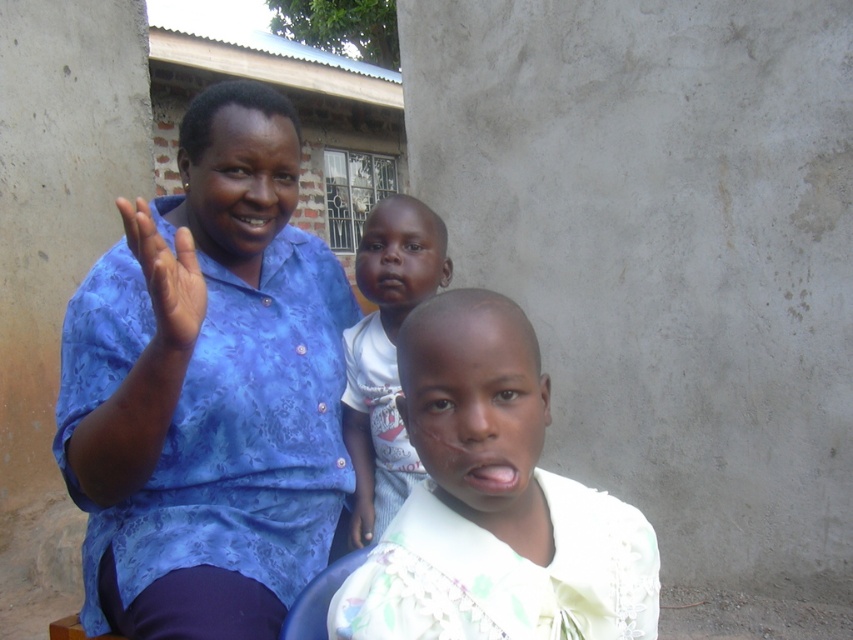
You are taking a photo of the scene and want to focus on both the point at point (126, 508) and the point at point (364, 243). Which point should you focus on first to ensure both are in focus?

You should focus on point (126, 508) first because it is closer to the camera than point (364, 243), so focusing on the closer point will help both points be in focus.

You are a photographer trying to capture a candid shot of the light skin baby at center without being noticed. Since the blue printed shirt at left is blocking your view, can you move to the right side to get a clear shot?

The blue printed shirt at left is closer to the viewer than the light skin baby at center, so moving to the right side may not help as the shirt is still blocking the view.

You are a photographer trying to capture a photo of the light beige fabric shirt at center and the light skin baby at center. Based on their positions, which one is closer to the camera?

The light skin baby at center is closer to the camera because the light beige fabric shirt at center is positioned under it.